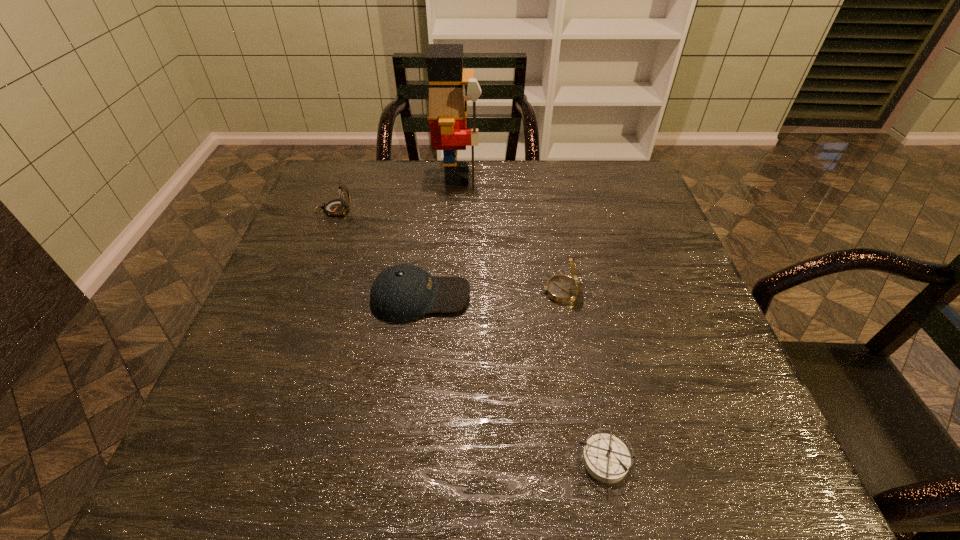
What are the coordinates of `vacant area that lies between the farthest object and the shortest compass` in the screenshot? It's located at (531, 318).

Find the location of a particular element. free space that is in between the shortest compass and the second shortest object is located at coordinates (513, 379).

The height and width of the screenshot is (540, 960). I want to click on free space between the nearest object and the farthest object, so click(531, 318).

Identify the location of free space between the shortest compass and the farthest object. The width and height of the screenshot is (960, 540). (531, 318).

You are a GUI agent. You are given a task and a screenshot of the screen. Output one action in this format:
    pyautogui.click(x=<x>, y=<y>)
    Task: Click on the free space that is in between the baseball cap and the second farthest compass
    The image size is (960, 540).
    Given the screenshot: What is the action you would take?
    pyautogui.click(x=491, y=294)

You are a GUI agent. You are given a task and a screenshot of the screen. Output one action in this format:
    pyautogui.click(x=<x>, y=<y>)
    Task: Click on the fourth closest object to the baseball cap
    This screenshot has height=540, width=960.
    Given the screenshot: What is the action you would take?
    pyautogui.click(x=448, y=109)

Image resolution: width=960 pixels, height=540 pixels. Identify the location of object that ranks as the third closest to the second shortest object. (606, 458).

Where is `compass that can be found as the closest to the baseball cap`? This screenshot has width=960, height=540. compass that can be found as the closest to the baseball cap is located at coordinates (563, 289).

Identify which compass is the second nearest to the second farthest compass. Please provide its 2D coordinates. Your answer should be formatted as a tuple, i.e. [(x, y)], where the tuple contains the x and y coordinates of a point satisfying the conditions above.

[(336, 207)]

The height and width of the screenshot is (540, 960). What are the coordinates of `vacant region that satisfies the following two spatial constraints: 1. on the face of the nearest compass; 2. on the right side of the second farthest object` in the screenshot? It's located at (235, 460).